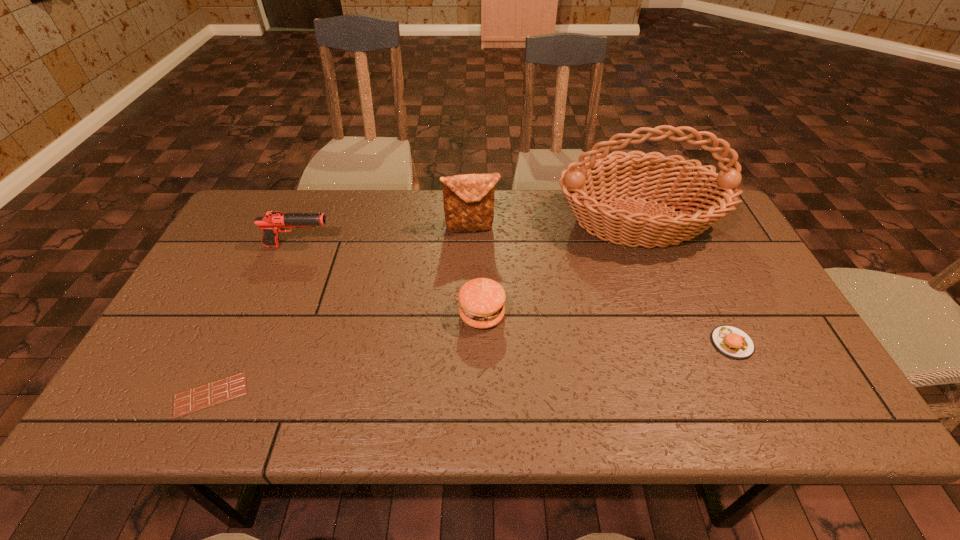
Image resolution: width=960 pixels, height=540 pixels. Identify the location of vacant space located on the open side of the clutch bag. (470, 294).

Find the location of a particular element. The height and width of the screenshot is (540, 960). free location located at the aiming end of the gun is located at coordinates (395, 246).

Locate an element on the screen. Image resolution: width=960 pixels, height=540 pixels. vacant space situated 0.270m on the back of the left patty is located at coordinates (482, 231).

At what (x,y) coordinates should I click in order to perform the action: click on free space located on the back of the second shortest object. Please return your answer as a coordinate pair (x, y). Looking at the image, I should click on (703, 282).

At what (x,y) coordinates should I click in order to perform the action: click on free spot located 0.400m on the right of the shortest object. Please return your answer as a coordinate pair (x, y). This screenshot has height=540, width=960. Looking at the image, I should click on (433, 395).

The width and height of the screenshot is (960, 540). I want to click on basket that is at the far edge, so click(601, 177).

This screenshot has width=960, height=540. In order to click on clutch bag that is at the far edge in this screenshot , I will do `click(468, 199)`.

Locate an element on the screen. object that is at the near edge is located at coordinates (228, 388).

Where is `gun present at the left edge`? gun present at the left edge is located at coordinates (273, 222).

Find the location of `chocolate bar at the left edge`. chocolate bar at the left edge is located at coordinates (228, 388).